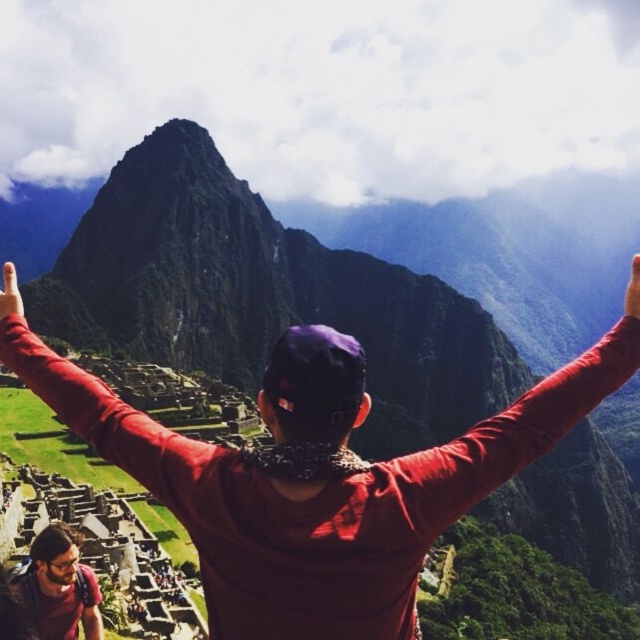
Question: Which object is positioned closest to the matte red hand at upper left?

Choices:
 (A) dark brown leather backpack at lower left
 (B) red smooth arm at upper center

Answer: (B)

Question: Where is red matte arm at upper center located in relation to dark brown leather backpack at lower left in the image?

Choices:
 (A) above
 (B) below

Answer: (A)

Question: Is dark brown leather backpack at lower left thinner than matte red hand at upper left?

Choices:
 (A) yes
 (B) no

Answer: (A)

Question: Where is red matte arm at upper center located in relation to dark brown leather backpack at lower left in the image?

Choices:
 (A) below
 (B) above

Answer: (B)

Question: Which of these objects is positioned closest to the dark brown leather backpack at lower left?

Choices:
 (A) matte red hand at upper left
 (B) red matte arm at upper center

Answer: (B)

Question: Which object appears farthest from the camera in this image?

Choices:
 (A) matte red hand at upper left
 (B) red matte arm at upper center
 (C) matte red finger at upper right

Answer: (A)